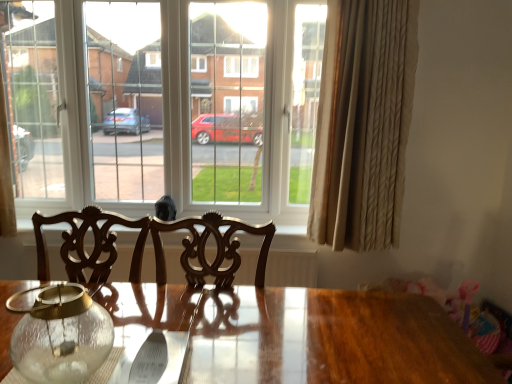
The image size is (512, 384). Identify the location of free region under transparent glass jar at lower left (from a real-world perspective). tap(58, 363).